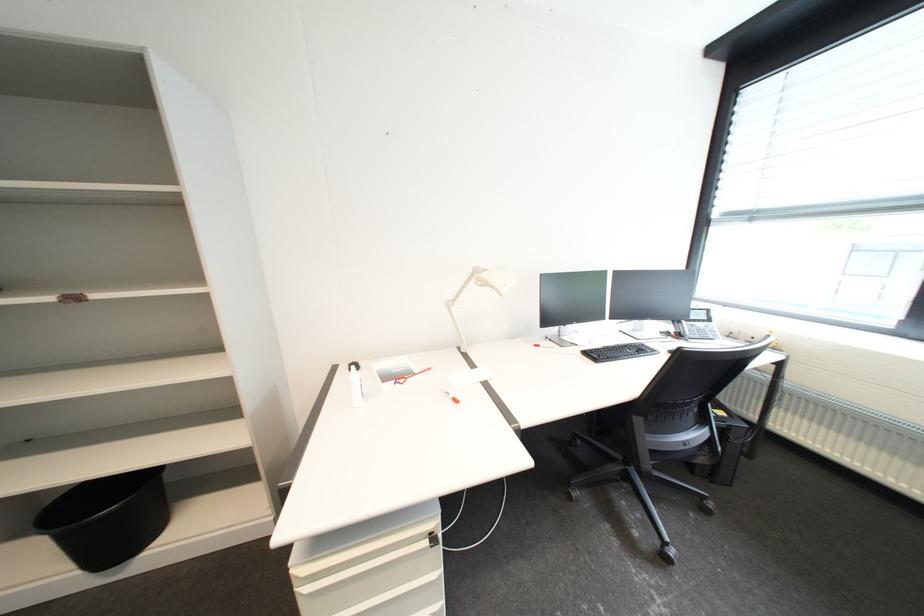
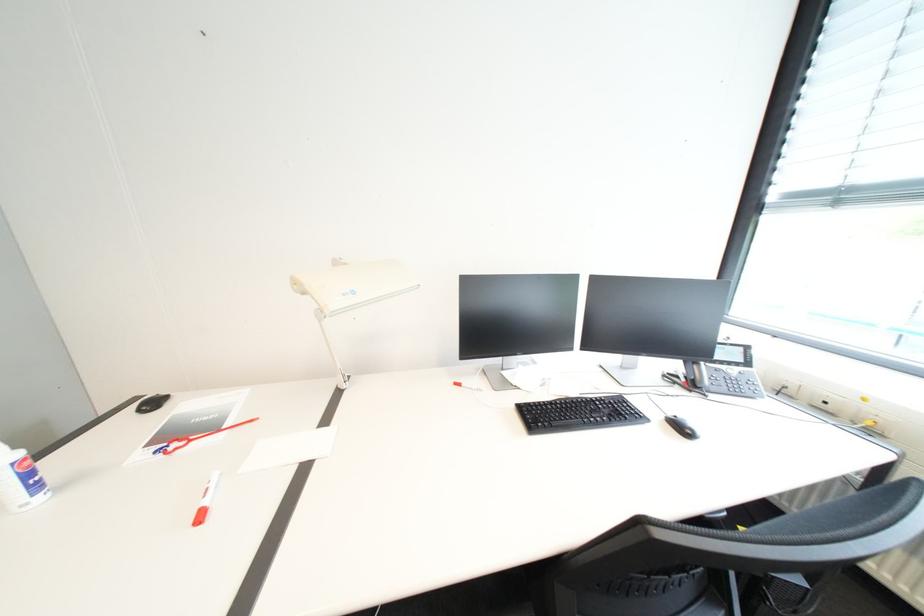
Question: The first image is from the beginning of the video and the second image is from the end. How did the camera likely rotate when shooting the video?

Choices:
 (A) Left
 (B) Right
 (C) Up
 (D) Down

Answer: (A)